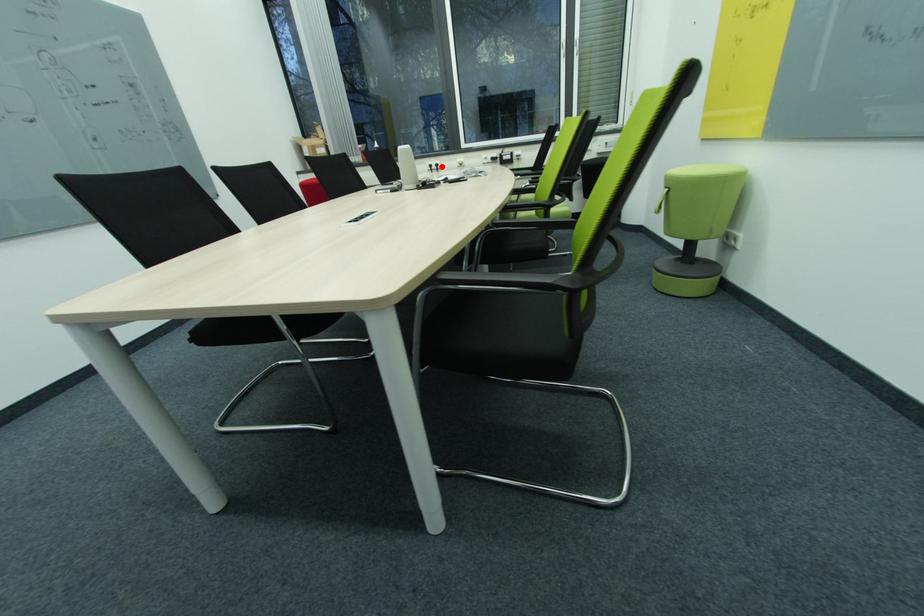
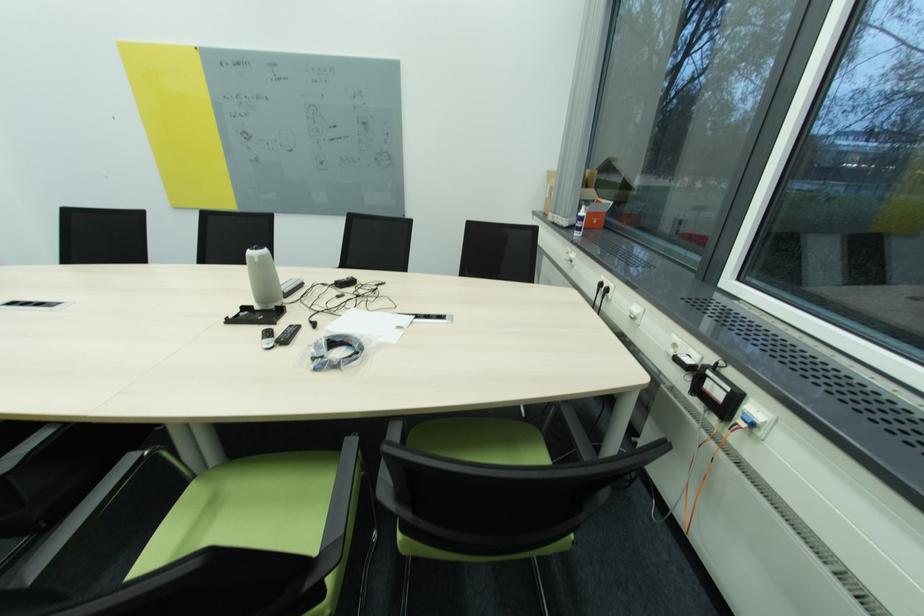
Where in the second image is the point corresponding to the highlighted location from the first image?

(612, 291)